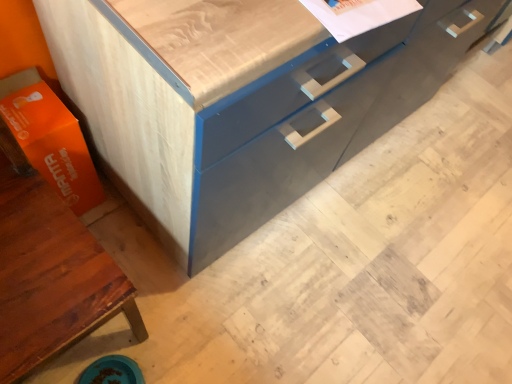
Question: From a real-world perspective, is orange matte cardboard box at lower left under matte wood cabinet at lower left?

Choices:
 (A) yes
 (B) no

Answer: (A)

Question: Is orange matte cardboard box at lower left shorter than matte wood cabinet at lower left?

Choices:
 (A) yes
 (B) no

Answer: (A)

Question: From the image's perspective, is orange matte cardboard box at lower left beneath matte wood cabinet at lower left?

Choices:
 (A) no
 (B) yes

Answer: (A)

Question: Can you confirm if orange matte cardboard box at lower left is taller than matte wood cabinet at lower left?

Choices:
 (A) no
 (B) yes

Answer: (A)

Question: Would you consider orange matte cardboard box at lower left to be distant from matte wood cabinet at lower left?

Choices:
 (A) yes
 (B) no

Answer: (B)

Question: Is point (226, 188) closer or farther from the camera than point (78, 188)?

Choices:
 (A) farther
 (B) closer

Answer: (B)

Question: Choose the correct answer: Is matte gray cabinet at center inside orange matte cardboard box at lower left or outside it?

Choices:
 (A) outside
 (B) inside

Answer: (A)

Question: In terms of height, does matte gray cabinet at center look taller or shorter compared to orange matte cardboard box at lower left?

Choices:
 (A) short
 (B) tall

Answer: (B)

Question: Looking at their shapes, would you say matte gray cabinet at center is wider or thinner than orange matte cardboard box at lower left?

Choices:
 (A) thin
 (B) wide

Answer: (B)

Question: Does point (54, 132) appear closer or farther from the camera than point (66, 26)?

Choices:
 (A) farther
 (B) closer

Answer: (A)

Question: In terms of width, does orange matte cardboard box at lower left look wider or thinner when compared to matte gray cabinet at center?

Choices:
 (A) thin
 (B) wide

Answer: (A)

Question: From a real-world perspective, is orange matte cardboard box at lower left above or below matte gray cabinet at center?

Choices:
 (A) below
 (B) above

Answer: (A)

Question: From the image's perspective, is orange matte cardboard box at lower left located above or below matte gray cabinet at center?

Choices:
 (A) below
 (B) above

Answer: (A)

Question: From a real-world perspective, is matte wood cabinet at lower left positioned above or below orange matte cardboard box at lower left?

Choices:
 (A) below
 (B) above

Answer: (B)

Question: Based on their sizes in the image, would you say matte wood cabinet at lower left is bigger or smaller than orange matte cardboard box at lower left?

Choices:
 (A) small
 (B) big

Answer: (B)